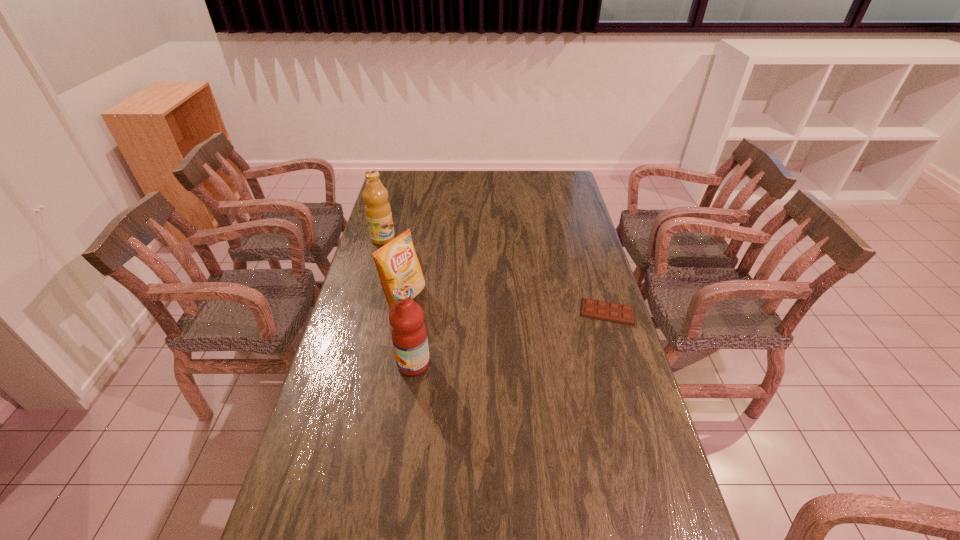
You are a GUI agent. You are given a task and a screenshot of the screen. Output one action in this format:
    pyautogui.click(x=<x>, y=<y>)
    Task: Click on the vacant space on the desktop that is between the fruit juice and the rightmost object and is positioned on the front-facing side of the crisp (potato chip)
    This screenshot has width=960, height=540.
    Given the screenshot: What is the action you would take?
    pyautogui.click(x=489, y=343)

Where is `free space on the desktop that is between the fruit juice and the rightmost object and is positioned on the label of the farthest object`? The image size is (960, 540). free space on the desktop that is between the fruit juice and the rightmost object and is positioned on the label of the farthest object is located at coordinates (509, 338).